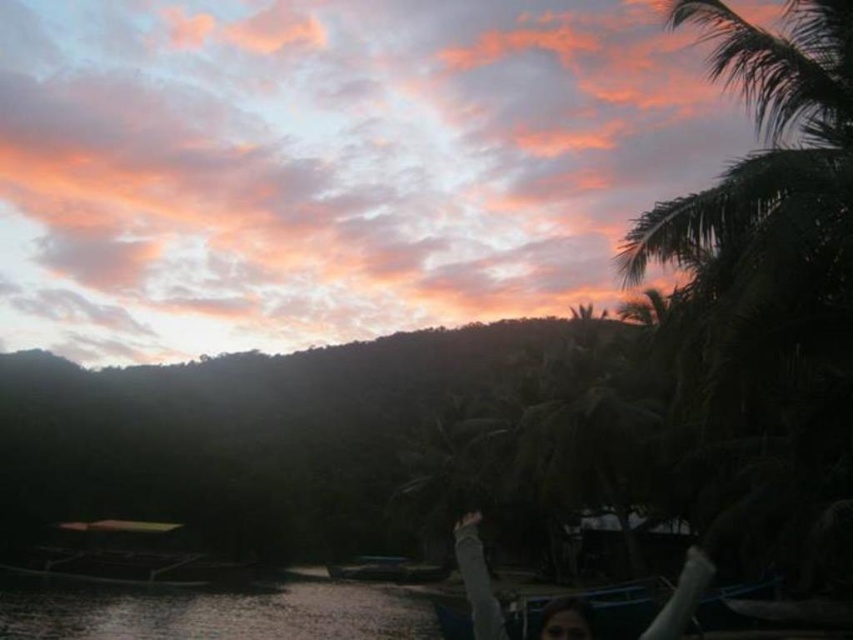
Question: Is clear water at lower left thinner than smooth skin person at lower center?

Choices:
 (A) yes
 (B) no

Answer: (B)

Question: Based on their relative distances, which object is nearer to the smooth skin person at lower center?

Choices:
 (A) metallic blue boat at center
 (B) clear water at lower left

Answer: (B)

Question: Estimate the real-world distances between objects in this image. Which object is closer to the smooth skin person at lower center?

Choices:
 (A) metallic blue boat at center
 (B) clear water at lower left

Answer: (B)

Question: Where is clear water at lower left located in relation to metallic blue boat at center in the image?

Choices:
 (A) right
 (B) left

Answer: (B)

Question: Considering the relative positions of clear water at lower left and metallic blue boat at center in the image provided, where is clear water at lower left located with respect to metallic blue boat at center?

Choices:
 (A) left
 (B) right

Answer: (A)

Question: Which object is positioned closest to the clear water at lower left?

Choices:
 (A) metallic blue boat at center
 (B) smooth skin person at lower center

Answer: (B)